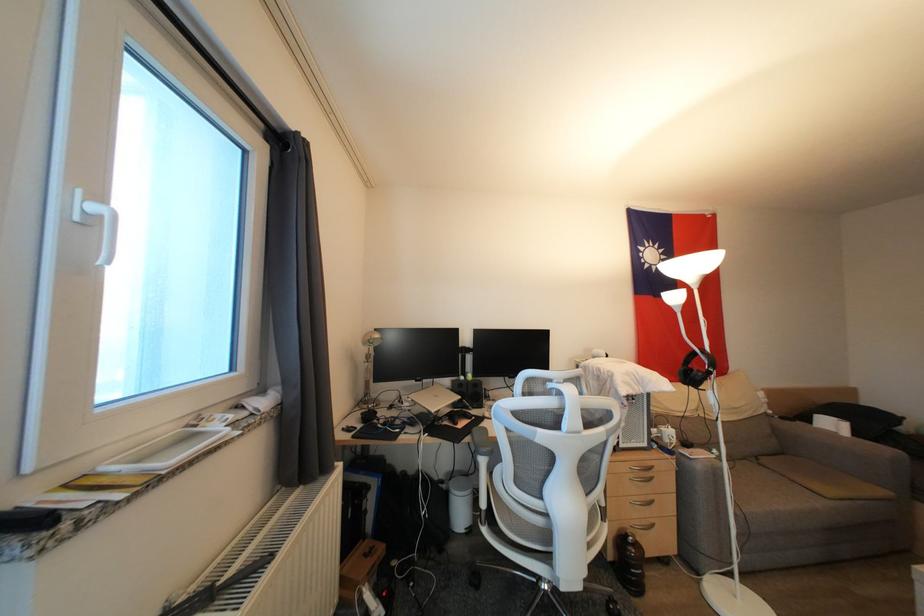
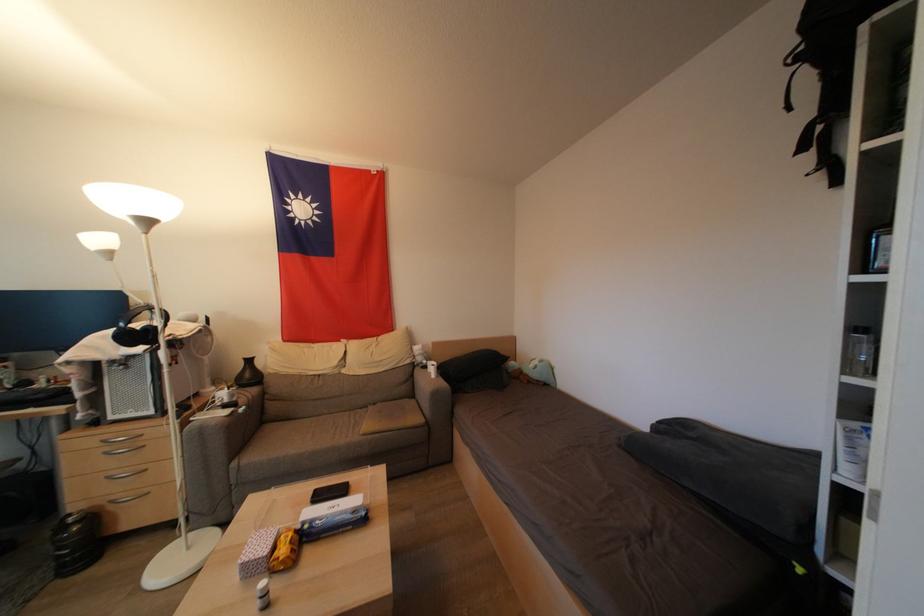
Question: The images are taken continuously from a first-person perspective. In which direction are you moving?

Choices:
 (A) Left
 (B) Right
 (C) Forward
 (D) Backward

Answer: (B)